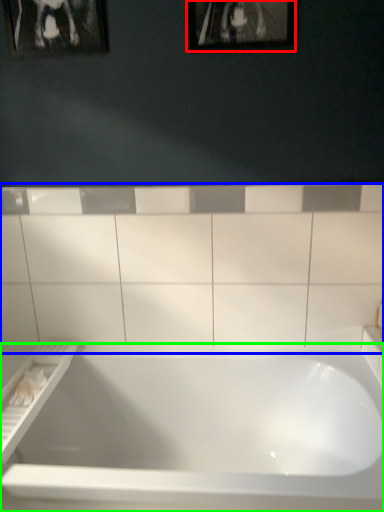
Question: Based on their relative distances, which object is farther from picture frame (highlighted by a red box)? Choose from ceramic tile (highlighted by a blue box) and bathtub (highlighted by a green box).

Choices:
 (A) ceramic tile
 (B) bathtub

Answer: (B)